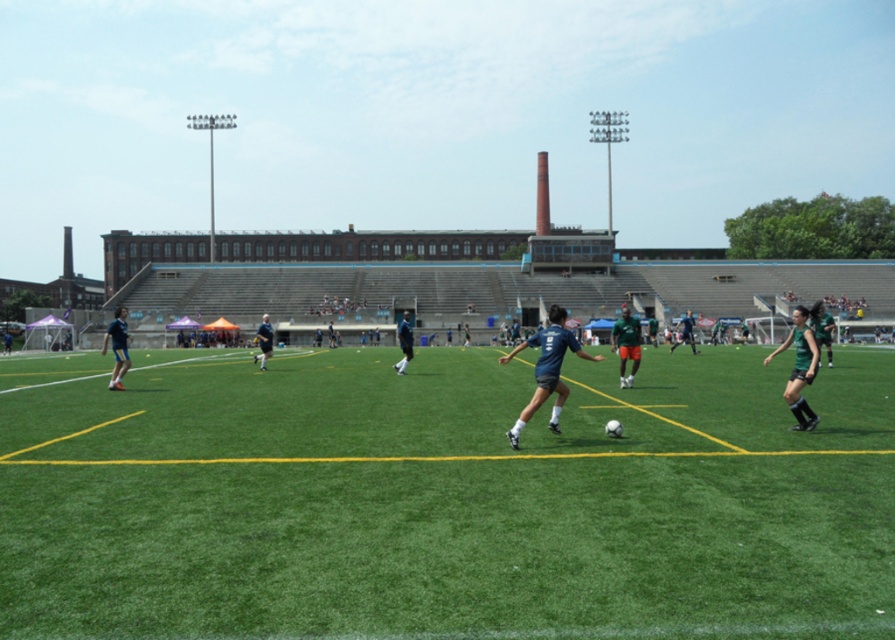
What do you see at coordinates (444, 499) in the screenshot? This screenshot has width=895, height=640. I see `green artificial turf at center` at bounding box center [444, 499].

Is point (699, 614) positioned before point (811, 356)?

Yes.

Is point (842, 621) positioned behind point (803, 330)?

No, (842, 621) is in front of (803, 330).

Find the location of a particular element. Image resolution: width=895 pixels, height=640 pixels. green artificial turf at center is located at coordinates (444, 499).

Can you confirm if blue fabric shorts at center is bigger than blue fabric jersey at center?

Actually, blue fabric shorts at center might be smaller than blue fabric jersey at center.

The width and height of the screenshot is (895, 640). What do you see at coordinates (546, 369) in the screenshot?
I see `blue fabric shorts at center` at bounding box center [546, 369].

Where is `blue fabric shorts at center`? The height and width of the screenshot is (640, 895). blue fabric shorts at center is located at coordinates (546, 369).

Between green matte shorts at right and green matte soccer player at right, which one has more height?

green matte soccer player at right is taller.

What do you see at coordinates (800, 365) in the screenshot? I see `green matte shorts at right` at bounding box center [800, 365].

Describe the element at coordinates (800, 365) in the screenshot. This screenshot has height=640, width=895. I see `green matte shorts at right` at that location.

I want to click on green matte shorts at right, so click(800, 365).